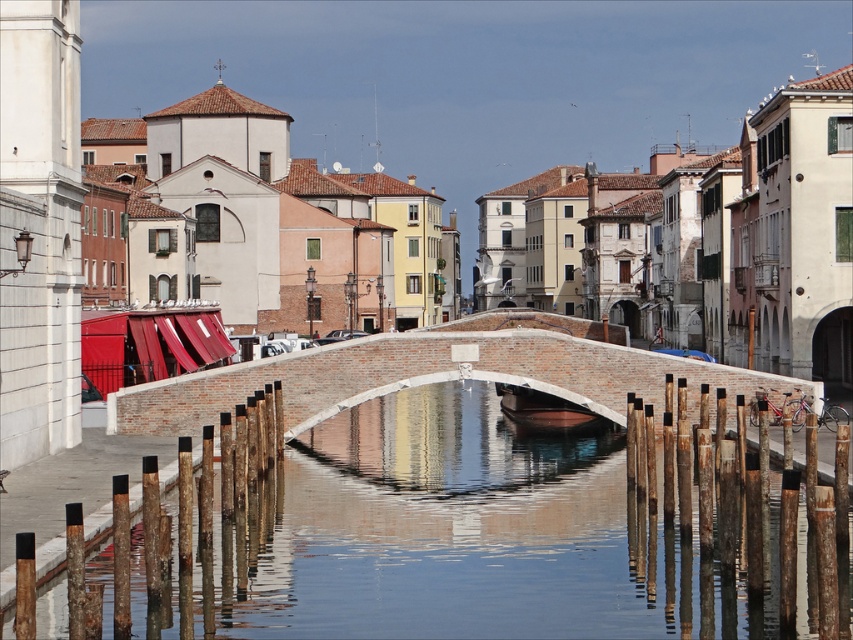
Question: Which point appears closest to the camera in this image?

Choices:
 (A) (688, 608)
 (B) (544, 364)
 (C) (517, 422)

Answer: (A)

Question: Among these points, which one is nearest to the camera?

Choices:
 (A) (506, 387)
 (B) (286, 548)
 (C) (361, 378)

Answer: (B)

Question: Is white brick bridge at center wider than brown wooden boat at center?

Choices:
 (A) no
 (B) yes

Answer: (B)

Question: Does white brick bridge at center come behind brown wooden boat at center?

Choices:
 (A) yes
 (B) no

Answer: (B)

Question: Is white brick bridge at center above brown wooden boat at center?

Choices:
 (A) no
 (B) yes

Answer: (B)

Question: Which object is closer to the camera taking this photo?

Choices:
 (A) brown wooden boat at center
 (B) white brick bridge at center
 (C) clear water at bridge center

Answer: (C)